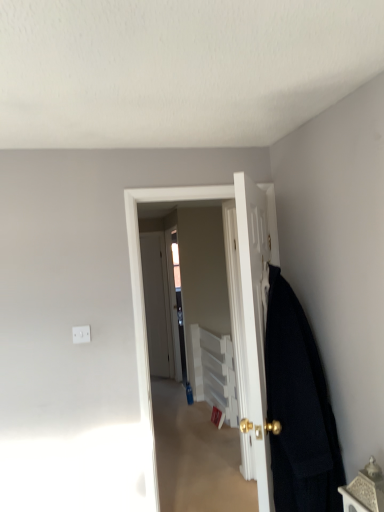
Question: Does dark woolen blanket at right have a smaller size compared to white plastic cabinet at center?

Choices:
 (A) no
 (B) yes

Answer: (B)

Question: Could you tell me if dark woolen blanket at right is turned towards white plastic cabinet at center?

Choices:
 (A) no
 (B) yes

Answer: (A)

Question: Is white plastic cabinet at center at the back of dark woolen blanket at right?

Choices:
 (A) yes
 (B) no

Answer: (B)

Question: Is dark woolen blanket at right outside of white plastic cabinet at center?

Choices:
 (A) no
 (B) yes

Answer: (B)

Question: Is white plastic cabinet at center surrounded by dark woolen blanket at right?

Choices:
 (A) no
 (B) yes

Answer: (A)

Question: Is white plastic cabinet at center inside or outside of clear glass screen door at center?

Choices:
 (A) inside
 (B) outside

Answer: (B)

Question: From a real-world perspective, is white plastic cabinet at center physically located above or below clear glass screen door at center?

Choices:
 (A) below
 (B) above

Answer: (A)

Question: Considering their positions, is white plastic cabinet at center located in front of or behind clear glass screen door at center?

Choices:
 (A) front
 (B) behind

Answer: (A)

Question: In the image, is white plastic cabinet at center on the left side or the right side of clear glass screen door at center?

Choices:
 (A) right
 (B) left

Answer: (A)

Question: Is white plastic cabinet at center spatially inside white glossy door at center, which appears as the 2th door when viewed from the front, or outside of it?

Choices:
 (A) inside
 (B) outside

Answer: (B)

Question: From a real-world perspective, is white plastic cabinet at center positioned above or below white glossy door at center, which appears as the 2th door when viewed from the front?

Choices:
 (A) above
 (B) below

Answer: (B)

Question: Based on their positions, is white plastic cabinet at center located to the left or right of white glossy door at center, which appears as the 2th door when viewed from the front?

Choices:
 (A) right
 (B) left

Answer: (A)

Question: Based on their sizes in the image, would you say white plastic cabinet at center is bigger or smaller than white glossy door at center, the 1th door when ordered from back to front?

Choices:
 (A) small
 (B) big

Answer: (A)

Question: Looking at the image, does white glossy door at center, which is the second door in back-to-front order, seem bigger or smaller compared to dark woolen blanket at right?

Choices:
 (A) small
 (B) big

Answer: (B)

Question: Relative to dark woolen blanket at right, is white glossy door at center, which is the first door from front to back, in front or behind?

Choices:
 (A) behind
 (B) front

Answer: (B)